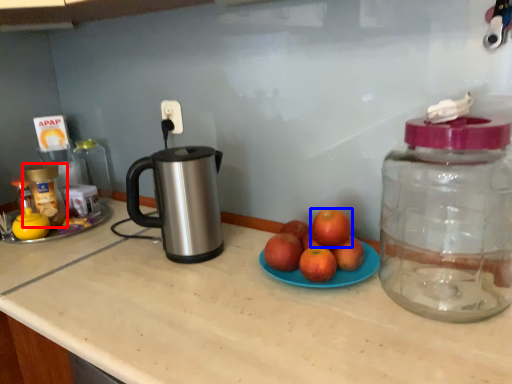
Question: Which of the following is the farthest to the observer, bottle (highlighted by a red box) or grapefruit (highlighted by a blue box)?

Choices:
 (A) bottle
 (B) grapefruit

Answer: (A)